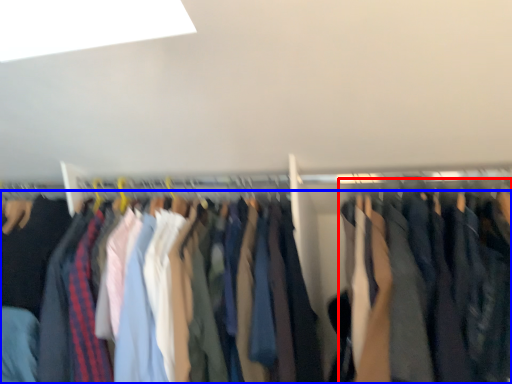
Question: Which point is further to the camera, clothing (highlighted by a red box) or trousers (highlighted by a blue box)?

Choices:
 (A) clothing
 (B) trousers

Answer: (B)